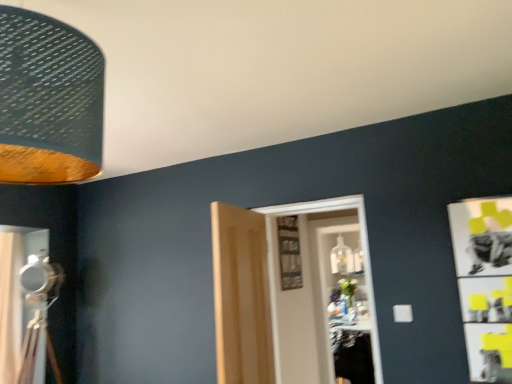
What is the approximate width of textured fabric lampshade at upper left?

46.01 centimeters.

What do you see at coordinates (241, 296) in the screenshot? I see `light wood paneling at center, the 1th door positioned from the left` at bounding box center [241, 296].

What do you see at coordinates (11, 304) in the screenshot? This screenshot has height=384, width=512. I see `matte silver curtain at left` at bounding box center [11, 304].

In order to face matte silver curtain at left, should I rotate leftwards or rightwards?

It's best to rotate left around 31.498 degrees.

The height and width of the screenshot is (384, 512). I want to click on metallic silver tripod at left, so click(x=39, y=311).

From a real-world perspective, relative to metallic silver tripod at left, is light wood paneling at center, the 1th door positioned from the left, vertically above or below?

light wood paneling at center, the 1th door positioned from the left, is situated higher than metallic silver tripod at left in the real world.

How distant is light wood paneling at center, the second door from the right, from metallic silver tripod at left?

light wood paneling at center, the second door from the right, and metallic silver tripod at left are 1.56 meters apart.

From the image's perspective, which one is positioned lower, light wood paneling at center, the second door from the right, or metallic silver tripod at left?

metallic silver tripod at left, from the image's perspective.

Considering the positions of point (238, 305) and point (30, 333), is point (238, 305) closer or farther from the camera than point (30, 333)?

Point (238, 305).

Is light wood paneling at center, the second door from the right, inside or outside of transparent glass door at center?

light wood paneling at center, the second door from the right, is outside transparent glass door at center.

Between light wood paneling at center, the second door from the right, and transparent glass door at center, which one has smaller width?

Thinner between the two is light wood paneling at center, the second door from the right.

Is light wood paneling at center, the 1th door positioned from the left, far from transparent glass door at center?

Yes, light wood paneling at center, the 1th door positioned from the left, is far from transparent glass door at center.

In the image, is light wood paneling at center, the 1th door positioned from the left, positioned in front of or behind white wooden door at center, arranged as the 2th door when viewed from the left?

light wood paneling at center, the 1th door positioned from the left, is positioned closer to the viewer than white wooden door at center, arranged as the 2th door when viewed from the left.

Are light wood paneling at center, the 1th door positioned from the left, and white wooden door at center, which is the 1th door in right-to-left order, making contact?

There is a gap between light wood paneling at center, the 1th door positioned from the left, and white wooden door at center, which is the 1th door in right-to-left order.

From the picture: Can you confirm if light wood paneling at center, the second door from the right, is positioned to the left of white wooden door at center, which is the 1th door in right-to-left order?

Yes.

Looking at this image, would you say metallic silver tripod at left is a long distance from matte silver curtain at left?

No.

Which of these two, metallic silver tripod at left or matte silver curtain at left, is wider?

metallic silver tripod at left is wider.

Which is nearer, (x=37, y=279) or (x=19, y=233)?

The point (x=37, y=279) is more forward.

Is metallic silver tripod at left positioned with its back to matte silver curtain at left?

No, metallic silver tripod at left is not facing away from matte silver curtain at left.

Is point (21, 302) closer or farther from the camera than point (89, 160)?

Point (21, 302) appears to be farther away from the viewer than point (89, 160).

Considering the relative sizes of matte silver curtain at left and textured fabric lampshade at upper left in the image provided, is matte silver curtain at left smaller than textured fabric lampshade at upper left?

No, matte silver curtain at left is not smaller than textured fabric lampshade at upper left.

Which is more to the right, matte silver curtain at left or textured fabric lampshade at upper left?

textured fabric lampshade at upper left.

Is matte silver curtain at left touching textured fabric lampshade at upper left?

No, matte silver curtain at left is not with textured fabric lampshade at upper left.

Is textured fabric lampshade at upper left outside of white wooden door at center, which is the 1th door in right-to-left order?

Indeed, textured fabric lampshade at upper left is completely outside white wooden door at center, which is the 1th door in right-to-left order.

Considering the relative positions of textured fabric lampshade at upper left and white wooden door at center, which is the 1th door in right-to-left order, in the image provided, is textured fabric lampshade at upper left to the left of white wooden door at center, which is the 1th door in right-to-left order, from the viewer's perspective?

Indeed, textured fabric lampshade at upper left is positioned on the left side of white wooden door at center, which is the 1th door in right-to-left order.

Are textured fabric lampshade at upper left and white wooden door at center, which is the 1th door in right-to-left order, located far from each other?

textured fabric lampshade at upper left is positioned a significant distance from white wooden door at center, which is the 1th door in right-to-left order.

Based on the photo, considering the positions of objects textured fabric lampshade at upper left and white wooden door at center, which is the 1th door in right-to-left order, in the image provided, who is in front, textured fabric lampshade at upper left or white wooden door at center, which is the 1th door in right-to-left order,?

textured fabric lampshade at upper left.

Based on the photo, can you tell me how much metallic silver tripod at left and white wooden door at center, arranged as the 2th door when viewed from the left, differ in facing direction?

metallic silver tripod at left and white wooden door at center, arranged as the 2th door when viewed from the left, are facing 43.2 degrees away from each other.

Considering the sizes of metallic silver tripod at left and white wooden door at center, which is the 1th door in right-to-left order, in the image, is metallic silver tripod at left bigger or smaller than white wooden door at center, which is the 1th door in right-to-left order,?

Clearly, metallic silver tripod at left is larger in size than white wooden door at center, which is the 1th door in right-to-left order.

Between metallic silver tripod at left and white wooden door at center, arranged as the 2th door when viewed from the left, which one appears on the left side from the viewer's perspective?

metallic silver tripod at left.

Could you tell me if metallic silver tripod at left is turned towards white wooden door at center, which is the 1th door in right-to-left order?

No, metallic silver tripod at left is not turned towards white wooden door at center, which is the 1th door in right-to-left order.

From a real-world perspective, which door is the 1st one above the metallic silver tripod at left? Please provide its 2D coordinates.

[(241, 296)]

Where is `glass door below the light wood paneling at center, the 1th door positioned from the left (from the image's perspective)`? The image size is (512, 384). glass door below the light wood paneling at center, the 1th door positioned from the left (from the image's perspective) is located at coordinates (343, 304).

Based on their spatial positions, is textured fabric lampshade at upper left or matte silver curtain at left further from transparent glass door at center?

textured fabric lampshade at upper left lies further to transparent glass door at center than the other object.

From the image, which object appears to be nearer to transparent glass door at center, white wooden door at center, which is the 1th door in right-to-left order, or textured fabric lampshade at upper left?

Among the two, white wooden door at center, which is the 1th door in right-to-left order, is located nearer to transparent glass door at center.

From the image, which object appears to be nearer to textured fabric lampshade at upper left, matte silver curtain at left or light wood paneling at center, the 1th door positioned from the left?

Among the two, light wood paneling at center, the 1th door positioned from the left, is located nearer to textured fabric lampshade at upper left.

Based on their spatial positions, is transparent glass door at center or white wooden door at center, arranged as the 2th door when viewed from the left, closer to textured fabric lampshade at upper left?

Among the two, white wooden door at center, arranged as the 2th door when viewed from the left, is located nearer to textured fabric lampshade at upper left.

Which object lies nearer to the anchor point textured fabric lampshade at upper left, light wood paneling at center, the 1th door positioned from the left, or white wooden door at center, which is the 1th door in right-to-left order?

light wood paneling at center, the 1th door positioned from the left, is closer to textured fabric lampshade at upper left.

Which object lies further to the anchor point textured fabric lampshade at upper left, metallic silver tripod at left or matte silver curtain at left?

Based on the image, metallic silver tripod at left appears to be further to textured fabric lampshade at upper left.

In the scene shown: Looking at the image, which one is located further to metallic silver tripod at left, transparent glass door at center or white wooden door at center, arranged as the 2th door when viewed from the left?

transparent glass door at center is positioned further to the anchor metallic silver tripod at left.

Based on the photo, from the image, which object appears to be nearer to light wood paneling at center, the 1th door positioned from the left, metallic silver tripod at left or transparent glass door at center?

The object closer to light wood paneling at center, the 1th door positioned from the left, is metallic silver tripod at left.

The image size is (512, 384). I want to click on door between matte silver curtain at left and white wooden door at center, which is the 1th door in right-to-left order, from left to right, so click(241, 296).

You are a GUI agent. You are given a task and a screenshot of the screen. Output one action in this format:
    pyautogui.click(x=<x>, y=<y>)
    Task: Click on the door positioned between light wood paneling at center, the 1th door positioned from the left, and transparent glass door at center from near to far
    This screenshot has height=384, width=512.
    Given the screenshot: What is the action you would take?
    pyautogui.click(x=291, y=290)

Find the location of a particular element. lamp between matte silver curtain at left and transparent glass door at center is located at coordinates (48, 100).

Locate an element on the screen. This screenshot has width=512, height=384. door situated between metallic silver tripod at left and white wooden door at center, which is the 1th door in right-to-left order, from left to right is located at coordinates (241, 296).